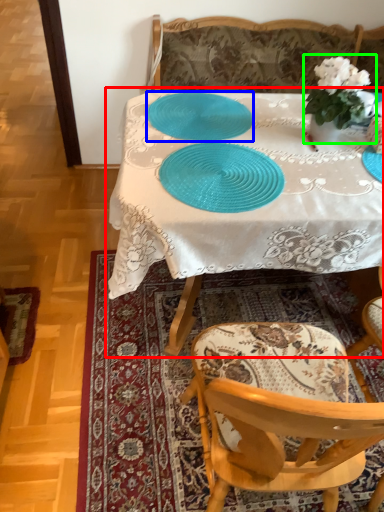
Question: Which object is positioned closest to table (highlighted by a red box)? Select from tableware (highlighted by a blue box) and houseplant (highlighted by a green box).

Choices:
 (A) tableware
 (B) houseplant

Answer: (A)